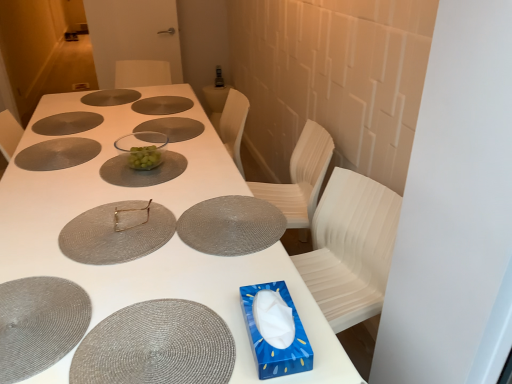
Question: Is matte silver fork at center located outside woven gray placemat at lower left?

Choices:
 (A) yes
 (B) no

Answer: (A)

Question: Does matte silver fork at center have a smaller size compared to woven gray placemat at lower left?

Choices:
 (A) no
 (B) yes

Answer: (B)

Question: Does matte silver fork at center turn towards woven gray placemat at lower left?

Choices:
 (A) no
 (B) yes

Answer: (A)

Question: Is matte silver fork at center to the left of woven gray placemat at lower left from the viewer's perspective?

Choices:
 (A) no
 (B) yes

Answer: (A)

Question: Is woven gray placemat at lower left a part of matte silver fork at center?

Choices:
 (A) yes
 (B) no

Answer: (B)

Question: From a real-world perspective, is matte silver fork at center located beneath woven gray placemat at lower left?

Choices:
 (A) yes
 (B) no

Answer: (B)

Question: From a real-world perspective, does matte gray placemat at center, arranged as the second glass plate when viewed from the front, stand above matte gray glass plate at upper left, which is counted as the 7th glass plate, starting from the front?

Choices:
 (A) yes
 (B) no

Answer: (B)

Question: From a real-world perspective, is matte gray placemat at center, arranged as the second glass plate when viewed from the front, below matte gray glass plate at upper left, which is counted as the 7th glass plate, starting from the front?

Choices:
 (A) yes
 (B) no

Answer: (A)

Question: Is matte gray placemat at center, the 8th glass plate positioned from the back, wider than matte gray glass plate at upper left, the third glass plate in the back-to-front sequence?

Choices:
 (A) yes
 (B) no

Answer: (B)

Question: From the image's perspective, would you say matte gray placemat at center, arranged as the second glass plate when viewed from the front, is shown under matte gray glass plate at upper left, the third glass plate in the back-to-front sequence?

Choices:
 (A) no
 (B) yes

Answer: (B)

Question: Considering the relative sizes of matte gray placemat at center, arranged as the second glass plate when viewed from the front, and matte gray glass plate at upper left, the third glass plate in the back-to-front sequence, in the image provided, is matte gray placemat at center, arranged as the second glass plate when viewed from the front, shorter than matte gray glass plate at upper left, the third glass plate in the back-to-front sequence,?

Choices:
 (A) yes
 (B) no

Answer: (A)

Question: Does matte gray placemat at center, the 8th glass plate positioned from the back, lie in front of matte gray glass plate at upper left, the third glass plate in the back-to-front sequence?

Choices:
 (A) no
 (B) yes

Answer: (B)

Question: Considering the relative sizes of transparent glass bowl at center, acting as the sixth glass plate starting from the back, and matte gray glass plate at upper center, which is the 9th glass plate from front to back, in the image provided, is transparent glass bowl at center, acting as the sixth glass plate starting from the back, smaller than matte gray glass plate at upper center, which is the 9th glass plate from front to back,?

Choices:
 (A) no
 (B) yes

Answer: (A)